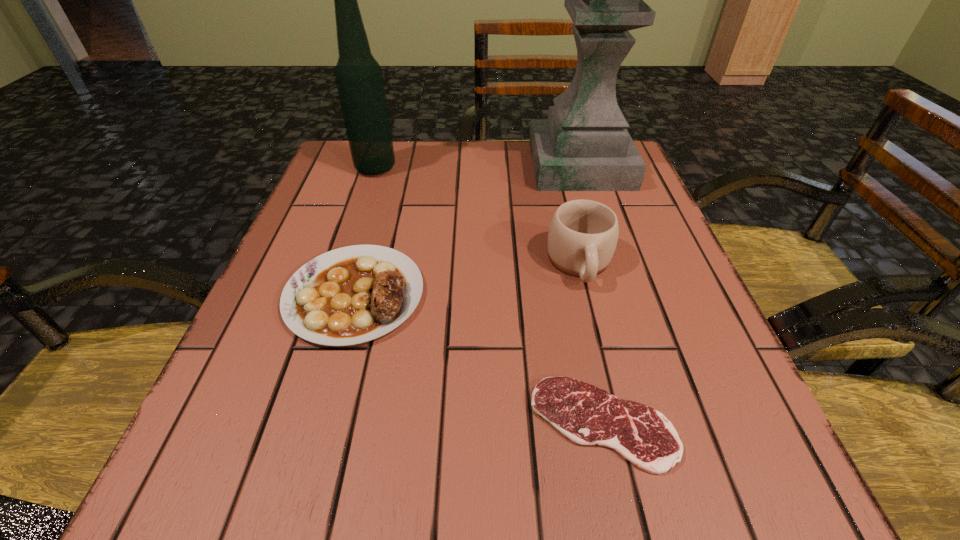
Where is `free spot at the near left corner of the desktop`? This screenshot has width=960, height=540. free spot at the near left corner of the desktop is located at coordinates (282, 508).

The height and width of the screenshot is (540, 960). What are the coordinates of `free spot between the alcohol and the mug` in the screenshot? It's located at (478, 215).

The image size is (960, 540). Identify the location of free space between the third shortest object and the nearer steak. (591, 343).

Locate an element on the screen. blank region between the shortest object and the second shortest object is located at coordinates (478, 359).

You are a GUI agent. You are given a task and a screenshot of the screen. Output one action in this format:
    pyautogui.click(x=<x>, y=<y>)
    Task: Click on the free space between the sculpture and the second tallest object
    The width and height of the screenshot is (960, 540).
    Given the screenshot: What is the action you would take?
    pyautogui.click(x=478, y=167)

The width and height of the screenshot is (960, 540). I want to click on free spot between the left steak and the tallest object, so click(468, 230).

At what (x,y) coordinates should I click in order to perform the action: click on vacant space in between the mug and the alcohol. Please return your answer as a coordinate pair (x, y). The image size is (960, 540). Looking at the image, I should click on tap(478, 215).

Identify the location of vacant space that's between the left steak and the sculpture. The height and width of the screenshot is (540, 960). [468, 230].

Select which object is the third closest to the fourth shortest object. Please provide its 2D coordinates. Your answer should be formatted as a tuple, i.e. [(x, y)], where the tuple contains the x and y coordinates of a point satisfying the conditions above.

[(583, 234)]

Point out which object is positioned as the nearest to the tallest object. Please provide its 2D coordinates. Your answer should be formatted as a tuple, i.e. [(x, y)], where the tuple contains the x and y coordinates of a point satisfying the conditions above.

[(583, 234)]